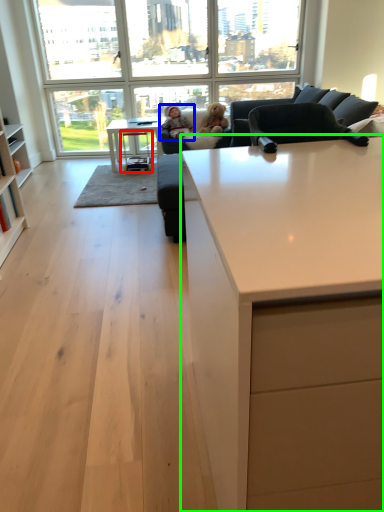
Question: Considering the real-world distances, which object is farthest from stool (highlighted by a red box)? person (highlighted by a blue box) or countertop (highlighted by a green box)?

Choices:
 (A) person
 (B) countertop

Answer: (B)